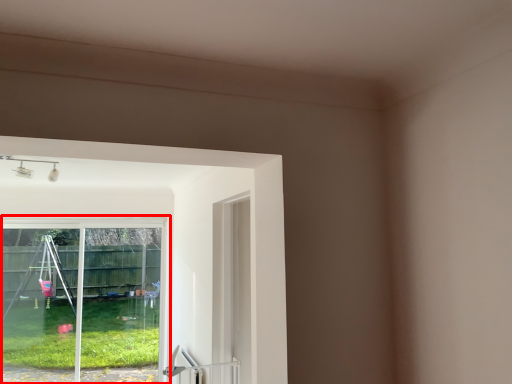
Question: From the image, what is the correct spatial relationship of window (annotated by the red box) in relation to door handle?

Choices:
 (A) right
 (B) left

Answer: (B)